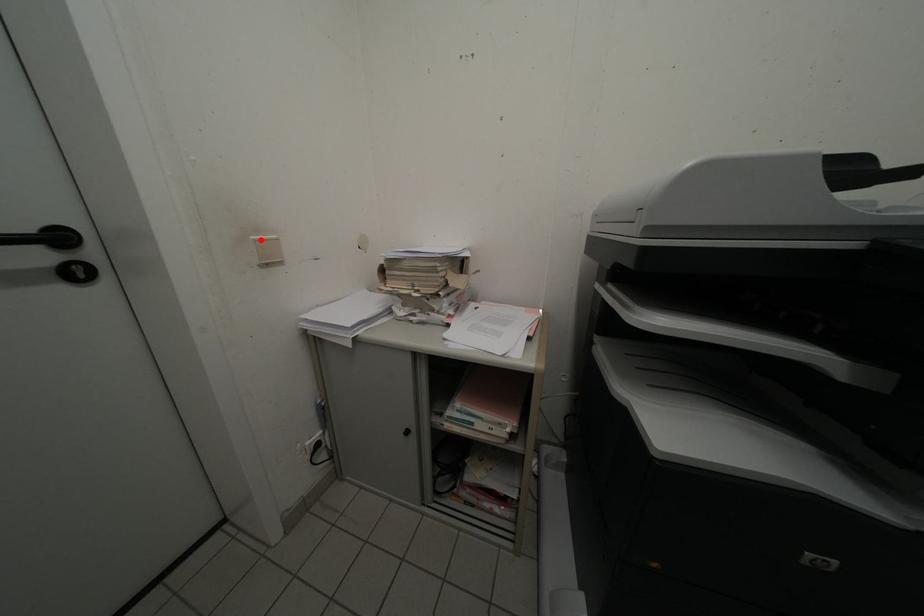
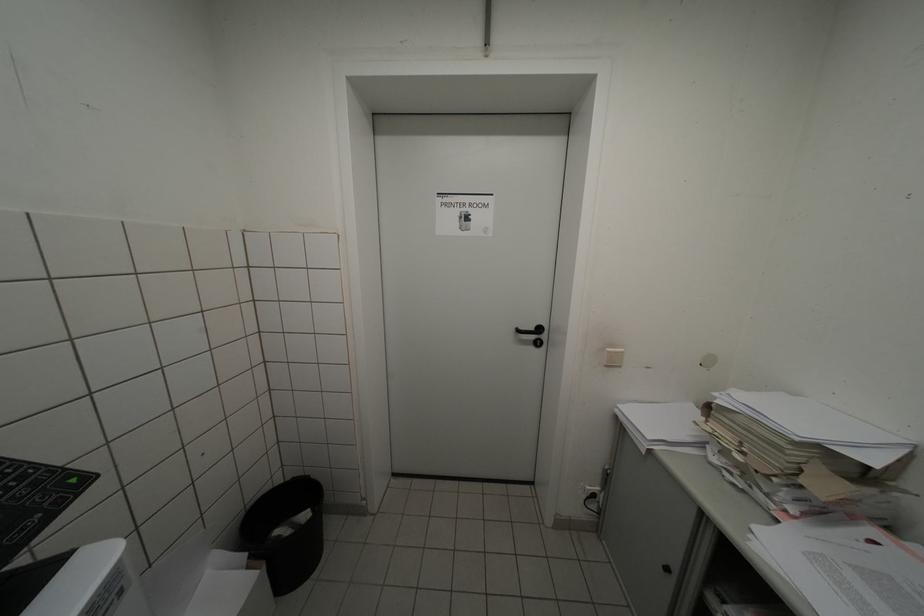
Find the pixel in the second image that matches the highlighted location in the first image.

(615, 352)